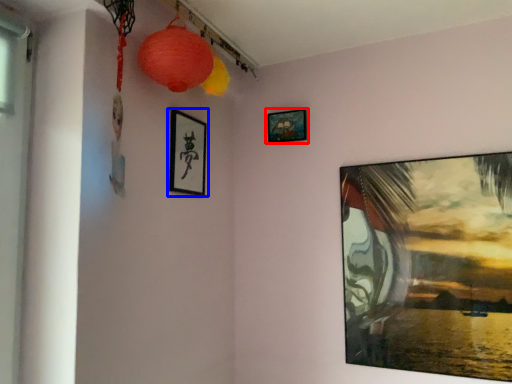
Question: Which object is closer to the camera taking this photo, picture frame (highlighted by a red box) or picture frame (highlighted by a blue box)?

Choices:
 (A) picture frame
 (B) picture frame

Answer: (B)